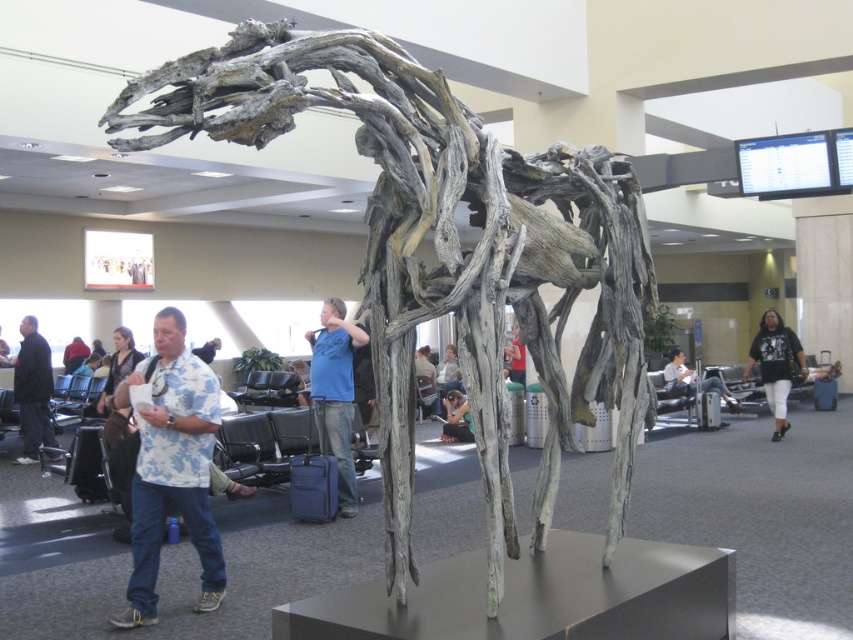
Does white floral shirt at center appear on the left side of matte gray sculpture at center?

Yes, white floral shirt at center is to the left of matte gray sculpture at center.

At what (x,y) coordinates should I click in order to perform the action: click on white floral shirt at center. Please return your answer as a coordinate pair (x, y). This screenshot has height=640, width=853. Looking at the image, I should click on (171, 467).

Who is more distant from viewer, [328,317] or [465,417]?

Positioned behind is point [465,417].

Which is more to the left, blue denim jeans at center or matte black camera at center?

blue denim jeans at center

Does point (316, 339) come farther from viewer compared to point (451, 426)?

No.

The height and width of the screenshot is (640, 853). I want to click on blue denim jeans at center, so click(335, 394).

In the scene shown: Is white floral shirt at center to the left of matte black camera at center from the viewer's perspective?

Indeed, white floral shirt at center is positioned on the left side of matte black camera at center.

Does white floral shirt at center have a greater width compared to matte black camera at center?

Yes.

Is point (193, 435) positioned behind point (461, 429)?

No, it is in front of (461, 429).

I want to click on white floral shirt at center, so click(x=171, y=467).